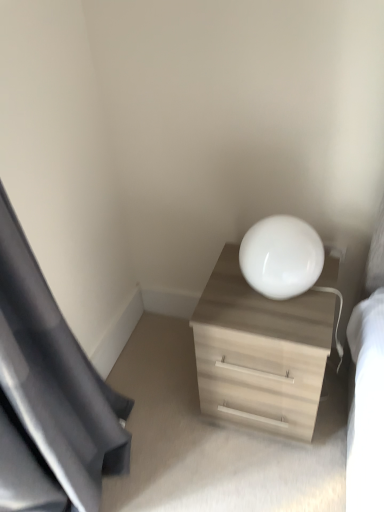
I want to click on free area in between light wood dresser at center and black fabric curtain at left, so click(187, 439).